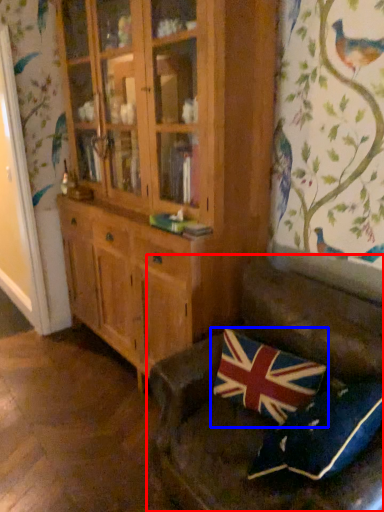
Question: Which object appears closest to the camera in this image, studio couch (highlighted by a red box) or pillow (highlighted by a blue box)?

Choices:
 (A) studio couch
 (B) pillow

Answer: (A)